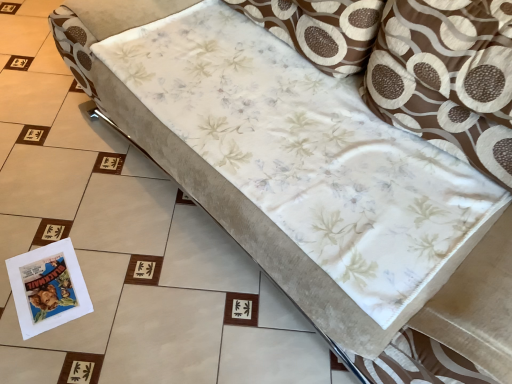
Question: From the image's perspective, is brown textured pillow at upper right above or below floral fabric pillow at upper right?

Choices:
 (A) below
 (B) above

Answer: (B)

Question: Considering the relative positions of brown textured pillow at upper right and floral fabric pillow at upper right in the image provided, is brown textured pillow at upper right to the left or to the right of floral fabric pillow at upper right?

Choices:
 (A) right
 (B) left

Answer: (B)

Question: Looking at the image, does brown textured pillow at upper right seem bigger or smaller compared to floral fabric pillow at upper right?

Choices:
 (A) big
 (B) small

Answer: (B)

Question: Considering the positions of floral fabric pillow at upper right and brown textured pillow at upper right in the image, is floral fabric pillow at upper right wider or thinner than brown textured pillow at upper right?

Choices:
 (A) wide
 (B) thin

Answer: (A)

Question: Is floral fabric pillow at upper right taller or shorter than brown textured pillow at upper right?

Choices:
 (A) tall
 (B) short

Answer: (A)

Question: Which is correct: floral fabric pillow at upper right is inside brown textured pillow at upper right, or outside of it?

Choices:
 (A) inside
 (B) outside

Answer: (B)

Question: From a real-world perspective, is floral fabric pillow at upper right physically located above or below brown textured pillow at upper right?

Choices:
 (A) above
 (B) below

Answer: (A)